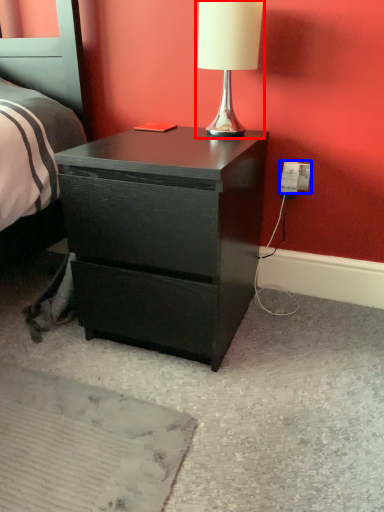
Question: Which of the following is the farthest to the observer, table lamp (highlighted by a red box) or electric outlet (highlighted by a blue box)?

Choices:
 (A) table lamp
 (B) electric outlet

Answer: (B)